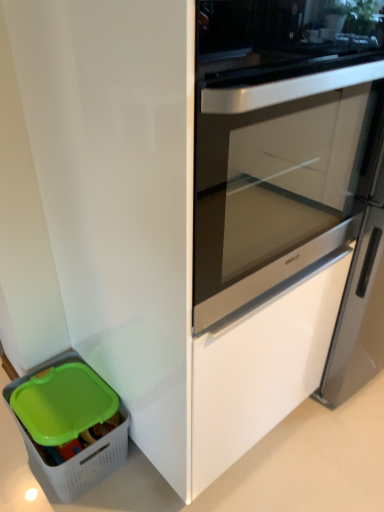
Question: From a real-world perspective, is white plastic basket at lower left physically located above or below white glossy screen door at center?

Choices:
 (A) above
 (B) below

Answer: (B)

Question: Would you say white plastic basket at lower left is to the left or to the right of white glossy screen door at center in the picture?

Choices:
 (A) right
 (B) left

Answer: (B)

Question: In terms of size, does white plastic basket at lower left appear bigger or smaller than white glossy screen door at center?

Choices:
 (A) small
 (B) big

Answer: (A)

Question: Is white glossy screen door at center wider or thinner than white plastic basket at lower left?

Choices:
 (A) thin
 (B) wide

Answer: (A)

Question: Would you say white glossy screen door at center is inside or outside white plastic basket at lower left?

Choices:
 (A) inside
 (B) outside

Answer: (B)

Question: From a real-world perspective, is white glossy screen door at center physically located above or below white plastic basket at lower left?

Choices:
 (A) below
 (B) above

Answer: (B)

Question: From the image's perspective, is white glossy screen door at center positioned above or below white plastic basket at lower left?

Choices:
 (A) above
 (B) below

Answer: (A)